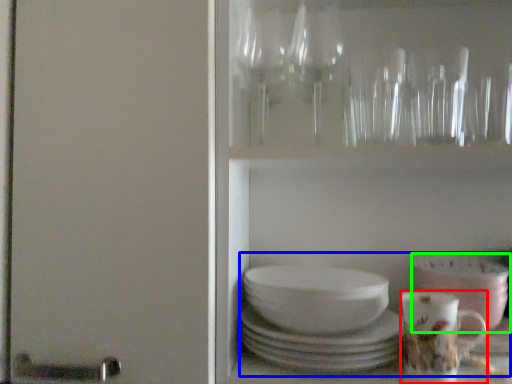
Question: Which is nearer to the coffee cup (highlighted by a red box)? tea set (highlighted by a blue box) or bowl (highlighted by a green box).

Choices:
 (A) tea set
 (B) bowl

Answer: (B)